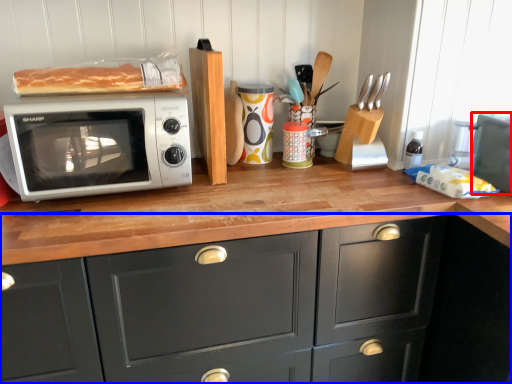
Question: Which object appears farthest to the camera in this image, appliance (highlighted by a red box) or cabinetry (highlighted by a blue box)?

Choices:
 (A) appliance
 (B) cabinetry

Answer: (A)